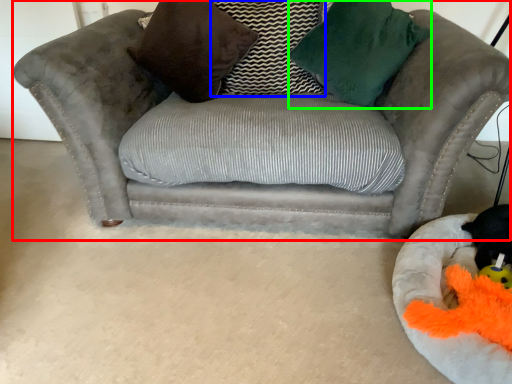
Question: Which object is the closest to the studio couch (highlighted by a red box)? Choose among these: pillow (highlighted by a blue box) or throw pillow (highlighted by a green box).

Choices:
 (A) pillow
 (B) throw pillow

Answer: (B)